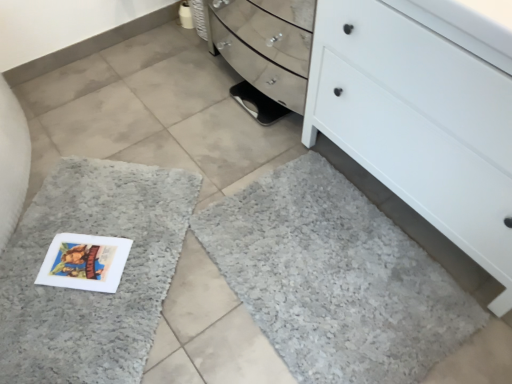
Question: Is gray shaggy bath mat at lower right, the 1th bath mat viewed from the right, to the right of white matte chest of drawers at lower right from the viewer's perspective?

Choices:
 (A) no
 (B) yes

Answer: (A)

Question: From the image's perspective, is gray shaggy bath mat at lower right, the 1th bath mat viewed from the right, under white matte chest of drawers at lower right?

Choices:
 (A) yes
 (B) no

Answer: (A)

Question: Is gray shaggy bath mat at lower right, the second bath mat when ordered from left to right, further to the viewer compared to white matte chest of drawers at lower right?

Choices:
 (A) yes
 (B) no

Answer: (A)

Question: Can you confirm if gray shaggy bath mat at lower right, the second bath mat when ordered from left to right, is taller than white matte chest of drawers at lower right?

Choices:
 (A) yes
 (B) no

Answer: (B)

Question: Is gray shaggy bath mat at lower right, the second bath mat when ordered from left to right, oriented away from white matte chest of drawers at lower right?

Choices:
 (A) no
 (B) yes

Answer: (B)

Question: Based on their sizes in the image, would you say gray shaggy bath mat at lower left, which is the second bath mat from right to left, is bigger or smaller than white matte chest of drawers at lower right?

Choices:
 (A) small
 (B) big

Answer: (A)

Question: Based on their positions, is gray shaggy bath mat at lower left, marked as the first bath mat in a left-to-right arrangement, located to the left or right of white matte chest of drawers at lower right?

Choices:
 (A) right
 (B) left

Answer: (B)

Question: Is gray shaggy bath mat at lower left, which is the second bath mat from right to left, in front of or behind white matte chest of drawers at lower right in the image?

Choices:
 (A) behind
 (B) front

Answer: (A)

Question: Which is correct: gray shaggy bath mat at lower left, which is the second bath mat from right to left, is inside white matte chest of drawers at lower right, or outside of it?

Choices:
 (A) outside
 (B) inside

Answer: (A)

Question: From the image's perspective, relative to black rubber shoe at center, is gray shaggy bath mat at lower left, which is the second bath mat from right to left, above or below?

Choices:
 (A) below
 (B) above

Answer: (A)

Question: Looking at the image, does gray shaggy bath mat at lower left, marked as the first bath mat in a left-to-right arrangement, seem bigger or smaller compared to black rubber shoe at center?

Choices:
 (A) small
 (B) big

Answer: (B)

Question: Considering the positions of gray shaggy bath mat at lower left, marked as the first bath mat in a left-to-right arrangement, and black rubber shoe at center in the image, is gray shaggy bath mat at lower left, marked as the first bath mat in a left-to-right arrangement, taller or shorter than black rubber shoe at center?

Choices:
 (A) short
 (B) tall

Answer: (B)

Question: Is gray shaggy bath mat at lower left, which is the second bath mat from right to left, in front of or behind black rubber shoe at center in the image?

Choices:
 (A) behind
 (B) front

Answer: (B)

Question: Based on their positions, is gray shaggy bath mat at lower left, which is the second bath mat from right to left, located to the left or right of gray shaggy bath mat at lower right, the second bath mat when ordered from left to right?

Choices:
 (A) left
 (B) right

Answer: (A)

Question: Considering the positions of gray shaggy bath mat at lower left, marked as the first bath mat in a left-to-right arrangement, and gray shaggy bath mat at lower right, the 1th bath mat viewed from the right, in the image, is gray shaggy bath mat at lower left, marked as the first bath mat in a left-to-right arrangement, taller or shorter than gray shaggy bath mat at lower right, the 1th bath mat viewed from the right,?

Choices:
 (A) short
 (B) tall

Answer: (B)